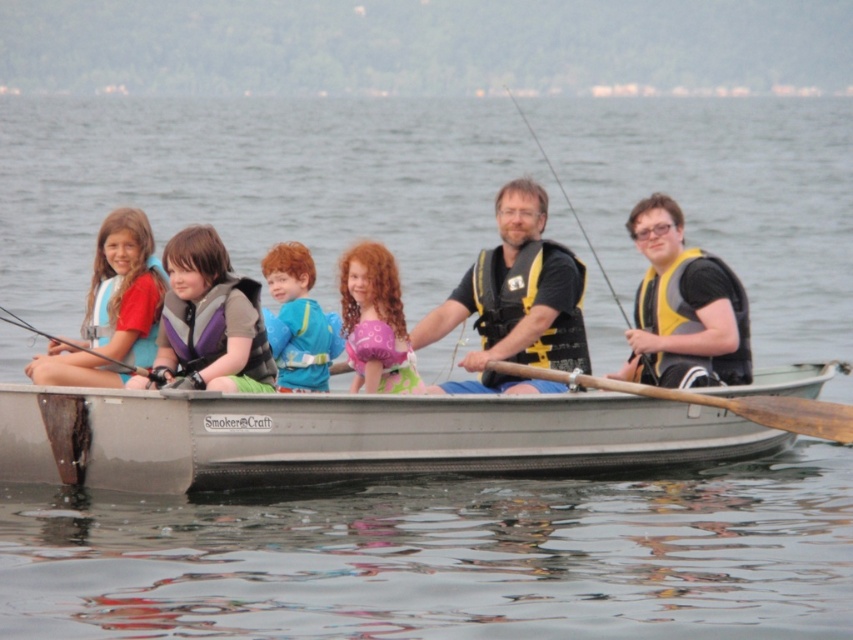
You are standing on the front part of the boat and want to move to the back. Which point should you walk towards, point at (123, 221) or point at (482, 259)?

You should walk towards point at (482, 259) because point at (123, 221) is in front of point at (482, 259), meaning the latter is further back in the boat.

You are a photographer on the shore observing the boat ride. You notice two items at the center of the boat. Which one is on the left side? The items are the purple life vest at center and the blue fabric shirt at center.

The purple life vest at center is positioned on the left side of the blue fabric shirt at center.